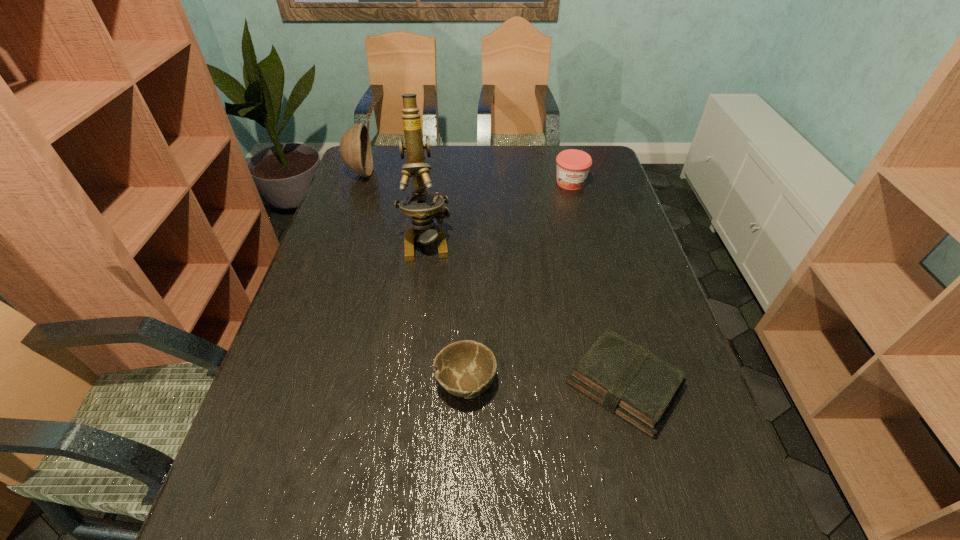
Locate an element on the screen. Image resolution: width=960 pixels, height=540 pixels. the tallest object is located at coordinates (423, 207).

Where is `the third nearest object`? This screenshot has width=960, height=540. the third nearest object is located at coordinates (423, 207).

Where is `the second tallest object`? the second tallest object is located at coordinates (355, 148).

I want to click on the taller bowl, so click(x=355, y=148).

You are a GUI agent. You are given a task and a screenshot of the screen. Output one action in this format:
    pyautogui.click(x=<x>, y=<y>)
    Task: Click on the third tallest object
    
    Given the screenshot: What is the action you would take?
    pyautogui.click(x=573, y=165)

Where is `the shorter bowl`? This screenshot has height=540, width=960. the shorter bowl is located at coordinates (466, 368).

The image size is (960, 540). What are the coordinates of `the nearer bowl` in the screenshot? It's located at (466, 368).

Where is `the shortest object`? the shortest object is located at coordinates (625, 378).

Where is `vacant area situated 0.200m on the right of the microscope`? vacant area situated 0.200m on the right of the microscope is located at coordinates (518, 240).

You are a GUI agent. You are given a task and a screenshot of the screen. Output one action in this format:
    pyautogui.click(x=<x>, y=<y>)
    Task: Click on the free space located on the right of the taller bowl
    The image size is (960, 540).
    Given the screenshot: What is the action you would take?
    pyautogui.click(x=477, y=173)